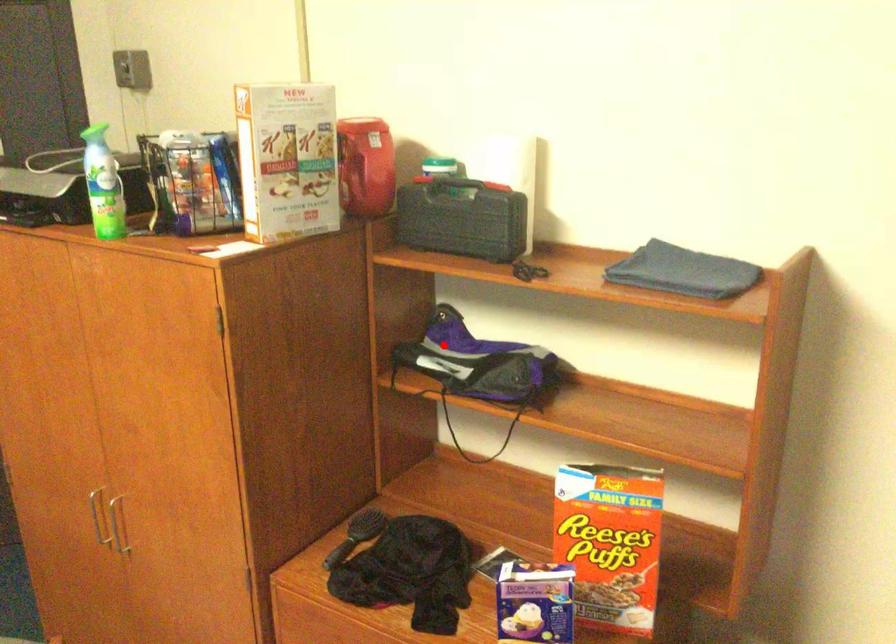
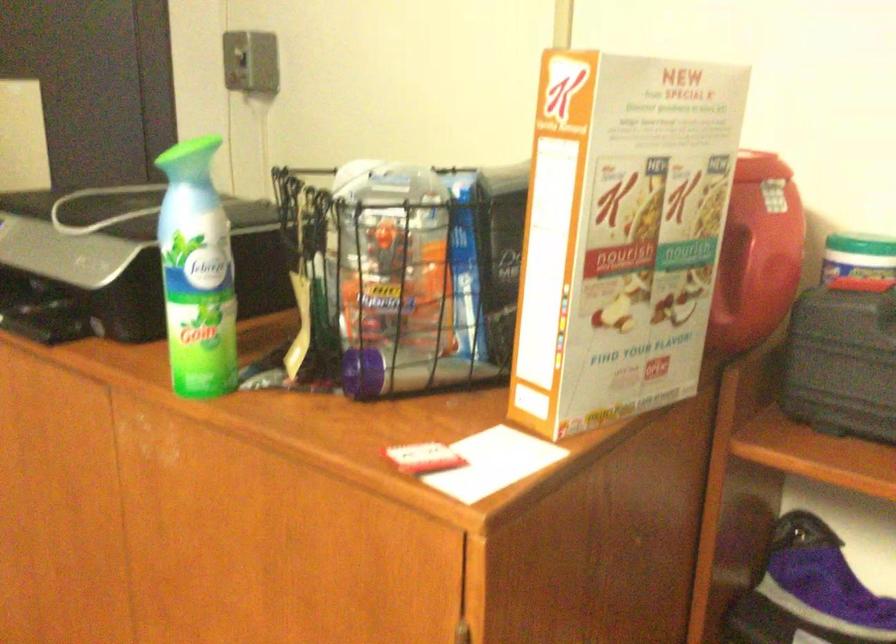
Locate, in the second image, the point that corresponds to the highlighted location in the first image.

(808, 592)